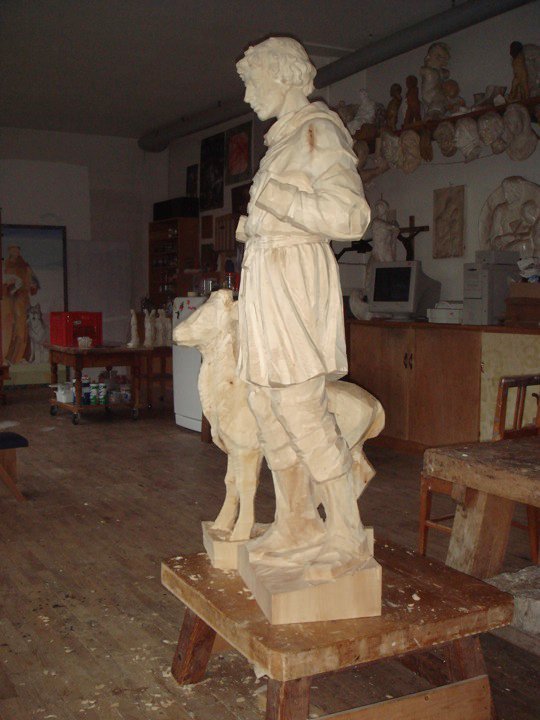
Image resolution: width=540 pixels, height=720 pixels. I want to click on wide wooden stool, so click(x=420, y=613).